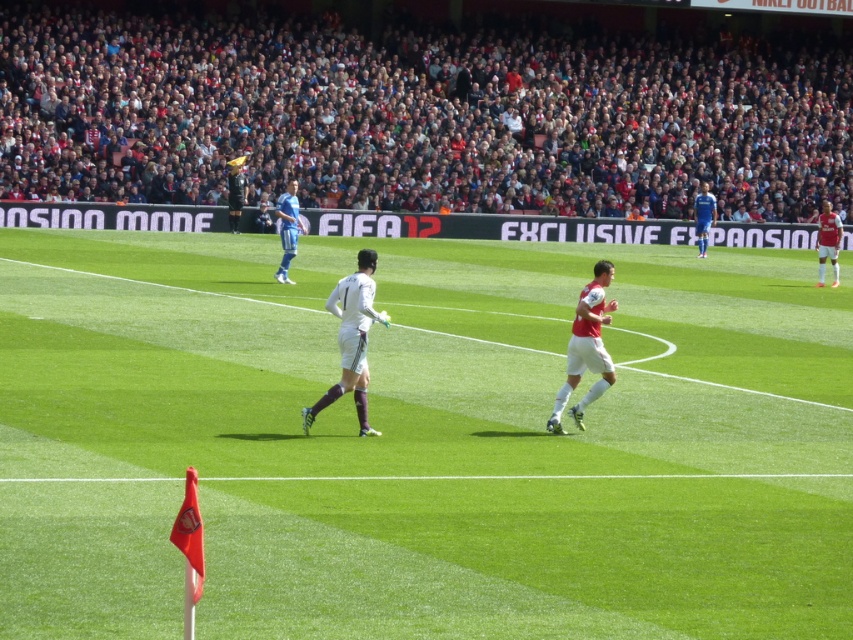
Can you confirm if white jersey at right is positioned to the left of black jersey at upper center?

In fact, white jersey at right is to the right of black jersey at upper center.

Who is lower down, white jersey at right or black jersey at upper center?

white jersey at right is below.

Is point (817, 246) positioned after point (238, 196)?

No, (817, 246) is in front of (238, 196).

At what (x,y) coordinates should I click in order to perform the action: click on white jersey at right. Please return your answer as a coordinate pair (x, y). This screenshot has width=853, height=640. Looking at the image, I should click on (828, 241).

Who is taller, white smooth soccer player at center or white matte jersey at center?

white smooth soccer player at center is taller.

Is point (363, 301) farther from viewer compared to point (573, 355)?

That is False.

The height and width of the screenshot is (640, 853). I want to click on white smooth soccer player at center, so click(x=351, y=339).

Identify the location of white smooth soccer player at center. The width and height of the screenshot is (853, 640). (351, 339).

Who is higher up, white jersey at right or blue jersey at right?

white jersey at right

The width and height of the screenshot is (853, 640). I want to click on white jersey at right, so click(x=828, y=241).

Locate an element on the screen. The width and height of the screenshot is (853, 640). white jersey at right is located at coordinates (828, 241).